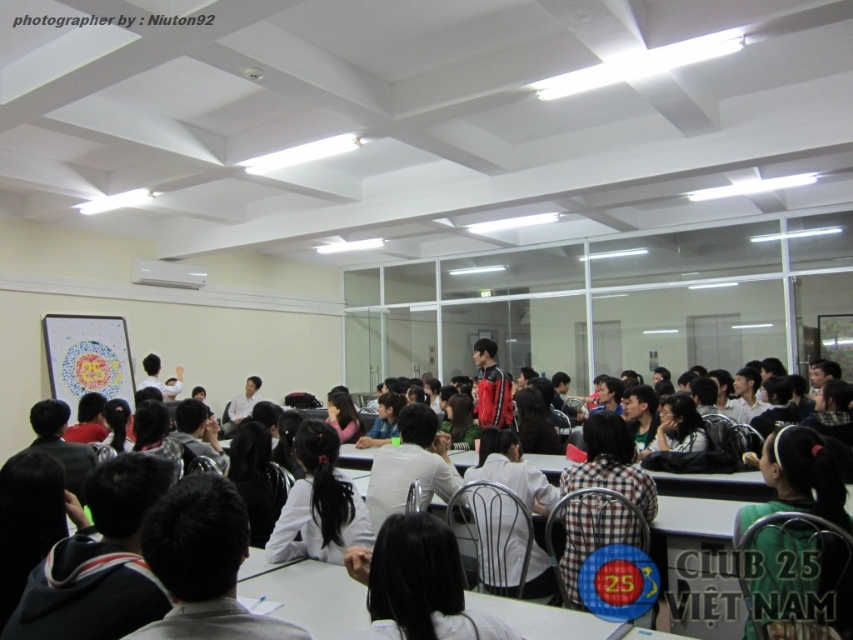
Is point (849, 534) less distant than point (660, 515)?

Yes, point (849, 534) is in front of point (660, 515).

Image resolution: width=853 pixels, height=640 pixels. Describe the element at coordinates (798, 538) in the screenshot. I see `green matte shirt at lower right` at that location.

What do you see at coordinates (798, 538) in the screenshot?
I see `green matte shirt at lower right` at bounding box center [798, 538].

I want to click on green matte shirt at lower right, so click(798, 538).

Who is positioned more to the left, green matte shirt at lower right or white plastic table at center?

white plastic table at center is more to the left.

Between green matte shirt at lower right and white plastic table at center, which one has more height?

green matte shirt at lower right is taller.

This screenshot has width=853, height=640. What do you see at coordinates (798, 538) in the screenshot?
I see `green matte shirt at lower right` at bounding box center [798, 538].

Where is `green matte shirt at lower right`? The height and width of the screenshot is (640, 853). green matte shirt at lower right is located at coordinates (798, 538).

Is matte black board at center to the left of red leather jacket at center from the viewer's perspective?

No, matte black board at center is not to the left of red leather jacket at center.

Who is positioned more to the left, matte black board at center or red leather jacket at center?

red leather jacket at center is more to the left.

Find the location of `matte black board at center`. matte black board at center is located at coordinates (306, 593).